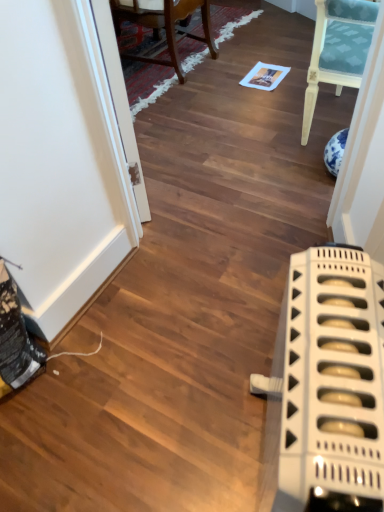
At what (x,y) coordinates should I click in order to perform the action: click on free space that is in between transparent glass door at upper left and wooden chair at upper center. Please return your answer as a coordinate pair (x, y). Looking at the image, I should click on (174, 121).